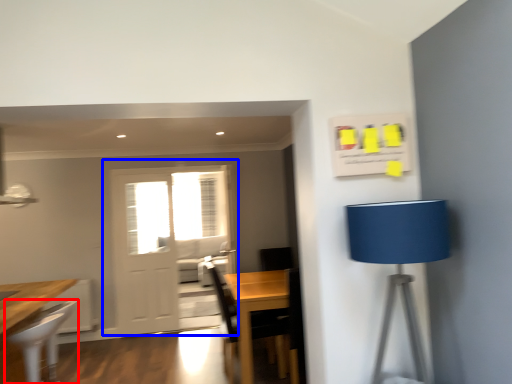
Question: Among these objects, which one is farthest to the camera, chair (highlighted by a red box) or door (highlighted by a blue box)?

Choices:
 (A) chair
 (B) door

Answer: (B)